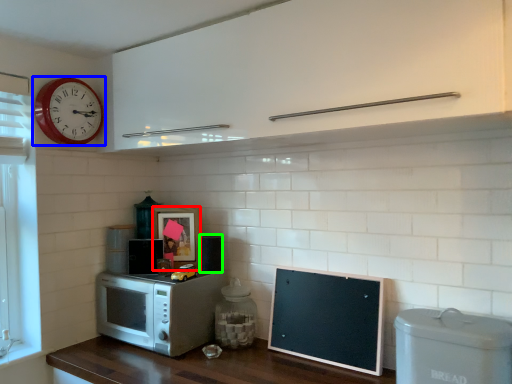
Question: Estimate the real-world distances between objects in this image. Which object is farther from picture frame (highlighted by a red box), wall clock (highlighted by a blue box) or appliance (highlighted by a green box)?

Choices:
 (A) wall clock
 (B) appliance

Answer: (A)